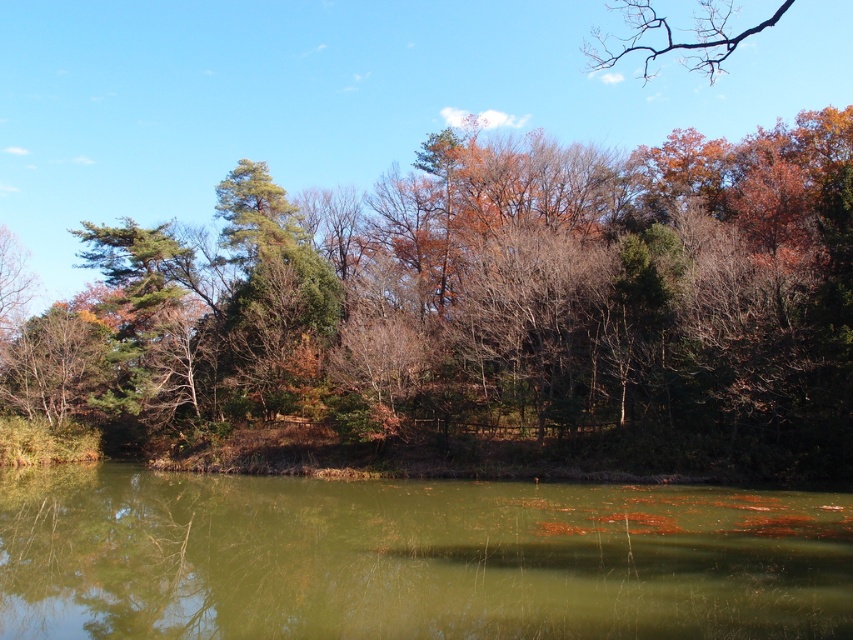
You are standing at the edge of the water and want to walk directly towards the green leafy tree at center. Given the coordinates provided, in which direction should you head?

The green leafy tree at center is located at point (480, 310), so you should head towards the center of the image to reach it.

You are standing at the edge of the water in the serene natural scene. There is a point marked at coordinates [480,310]. What object is located at that point?

The point at coordinates [480,310] corresponds to the green leafy tree at center.